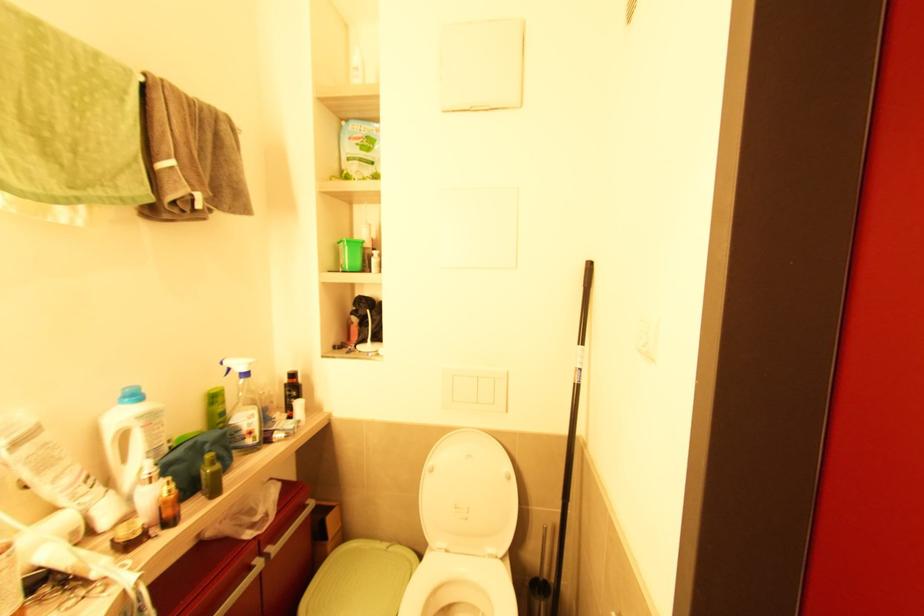
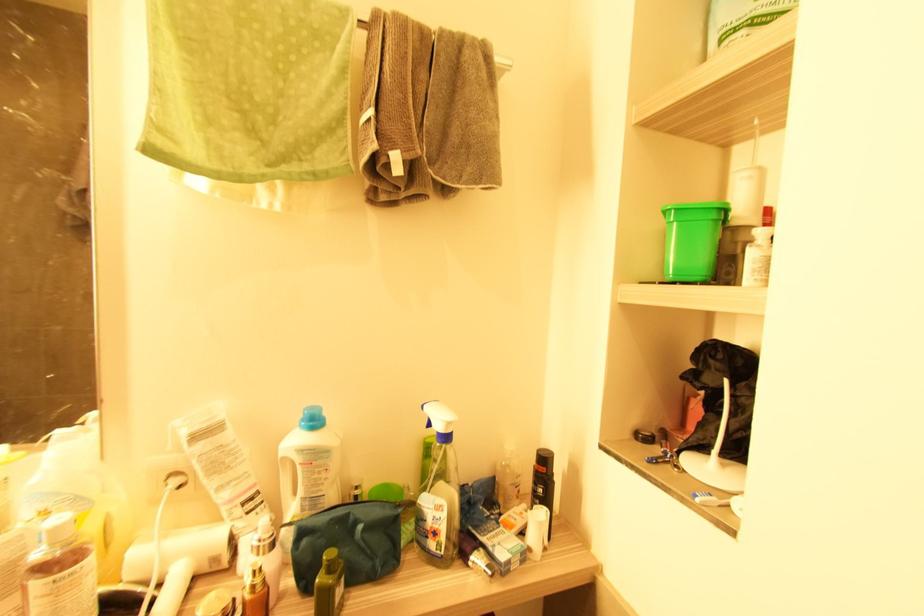
Locate, in the second image, the point that corresponds to (209,447) in the first image.

(361, 529)